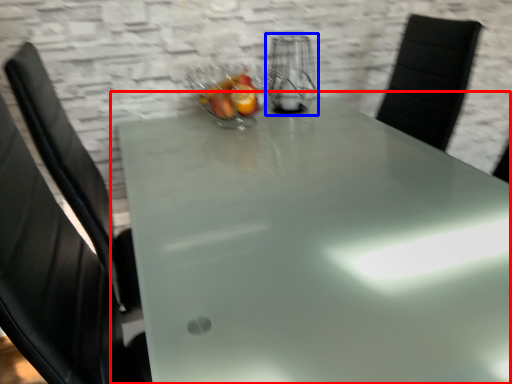
Question: Which of the following is the closest to the observer, table (highlighted by a red box) or appliance (highlighted by a blue box)?

Choices:
 (A) table
 (B) appliance

Answer: (A)